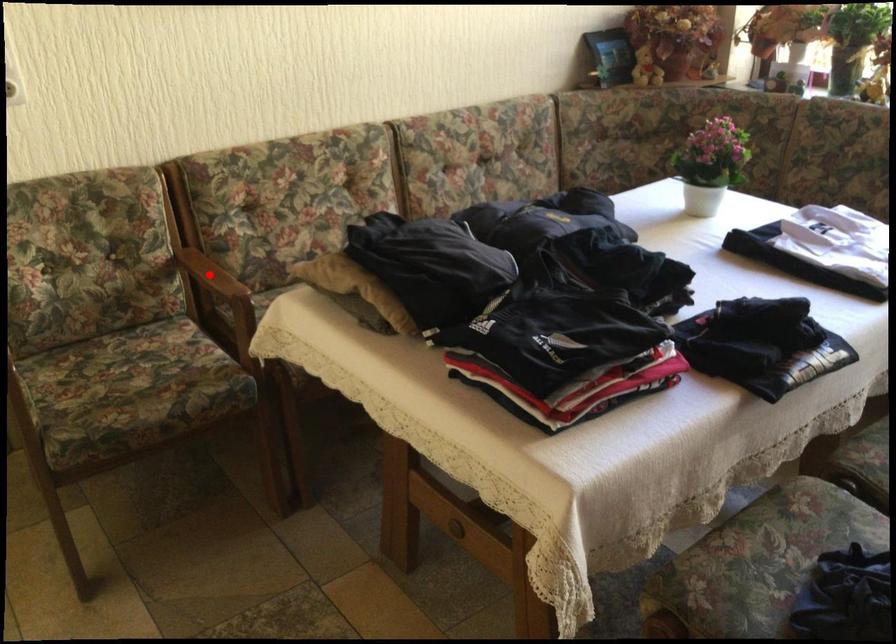
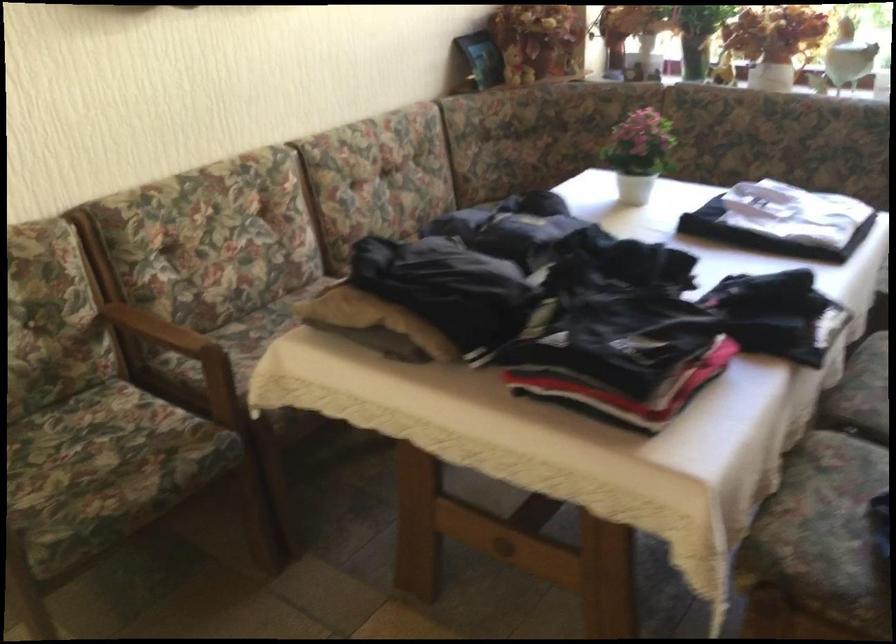
Question: I am providing you with two images of the same scene from different viewpoints. A red point is shown in image1. For the corresponding object point in image2, is it positioned nearer or farther from the camera?

Choices:
 (A) Nearer
 (B) Farther

Answer: (A)